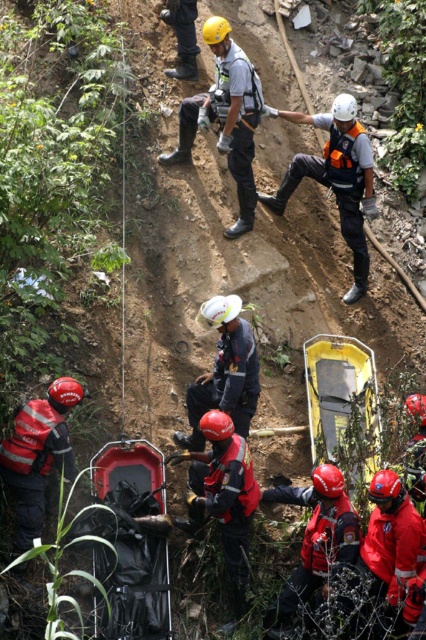
Consider the image. You are a safety inspector evaluating the equipment in the rescue operation. The white hard hat at upper center and the red matte helmet at lower left are both being used. Based on their sizes, which one might provide better protection against falling debris?

The white hard hat at upper center has a larger width than the red matte helmet at lower left, so it might provide better protection against falling debris due to its increased coverage area.

You are a member of the rescue team and need to retrieve the red matte helmet at lower left. However, you are currently standing near the black plastic stretcher at center. Can you reach the helmet without moving the stretcher?

The black plastic stretcher at center is closer to the viewer than the red matte helmet at lower left, so the stretcher is blocking your path to the helmet. You would need to move the stretcher to access the helmet.